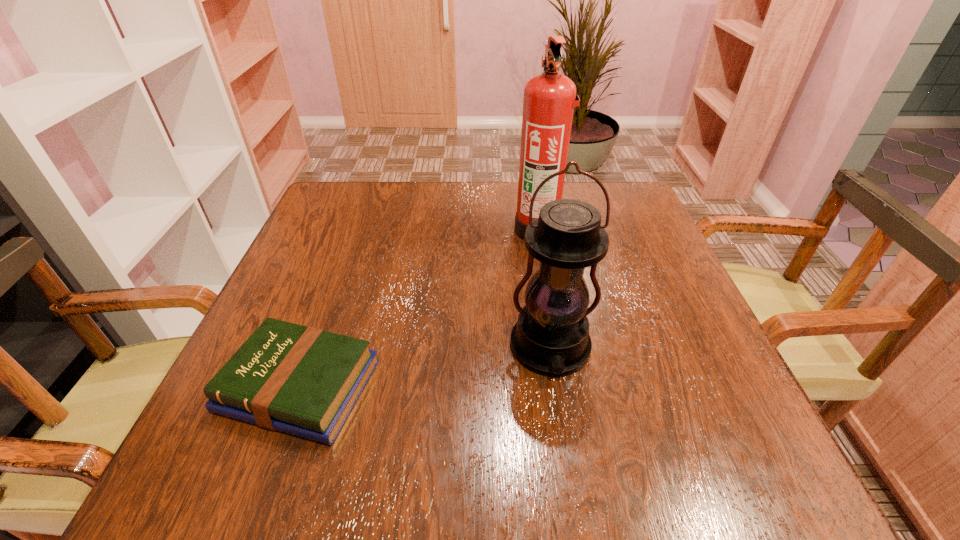
Locate an element on the screen. This screenshot has height=540, width=960. free space between the leftmost object and the lantern is located at coordinates click(x=425, y=367).

Locate an element on the screen. The width and height of the screenshot is (960, 540). free space between the shortest object and the fire extinguisher is located at coordinates (419, 308).

Where is `free space between the fire extinguisher and the shortest object`? The width and height of the screenshot is (960, 540). free space between the fire extinguisher and the shortest object is located at coordinates (419, 308).

This screenshot has width=960, height=540. I want to click on the closest object relative to the lantern, so click(549, 98).

Image resolution: width=960 pixels, height=540 pixels. I want to click on object that can be found as the second closest to the lantern, so click(304, 381).

Locate an element on the screen. The image size is (960, 540). vacant space that satisfies the following two spatial constraints: 1. with the nozzle pointing from the back of the farthest object; 2. above the lantern, indicating its light source is located at coordinates (558, 347).

Identify the location of vacant point that satisfies the following two spatial constraints: 1. with the nozzle pointing from the back of the tallest object; 2. above the lantern, indicating its light source. The width and height of the screenshot is (960, 540). (558, 347).

This screenshot has width=960, height=540. In order to click on vacant space that satisfies the following two spatial constraints: 1. with the nozzle pointing from the back of the fire extinguisher; 2. above the second tallest object, indicating its light source in this screenshot , I will do `click(558, 347)`.

At what (x,y) coordinates should I click in order to perform the action: click on free space in the image that satisfies the following two spatial constraints: 1. with the nozzle pointing from the back of the fire extinguisher; 2. above the lantern, indicating its light source. Please return your answer as a coordinate pair (x, y). Image resolution: width=960 pixels, height=540 pixels. Looking at the image, I should click on (558, 347).

Find the location of a particular element. The width and height of the screenshot is (960, 540). vacant space that satisfies the following two spatial constraints: 1. with the nozzle pointing from the back of the fire extinguisher; 2. above the lantern, indicating its light source is located at coordinates (558, 347).